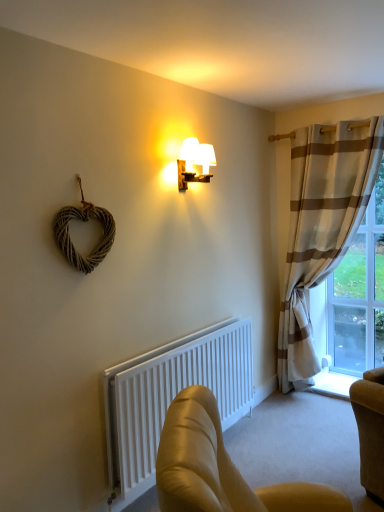
Question: Considering their positions, is white matte radiator at lower center located in front of or behind leather armchair at lower center?

Choices:
 (A) front
 (B) behind

Answer: (B)

Question: Looking at the image, does white matte radiator at lower center seem bigger or smaller compared to leather armchair at lower center?

Choices:
 (A) big
 (B) small

Answer: (A)

Question: Which object is the farthest from the white matte radiator at lower center?

Choices:
 (A) white striped fabric curtain at right
 (B) woodenmaterial/texturelamp at upper center
 (C) leather armchair at lower center
 (D) clear glass window at right

Answer: (D)

Question: Which is farther from the clear glass window at right?

Choices:
 (A) leather armchair at lower center
 (B) woodenmaterial/texturelamp at upper center
 (C) white striped fabric curtain at right
 (D) white matte radiator at lower center

Answer: (A)